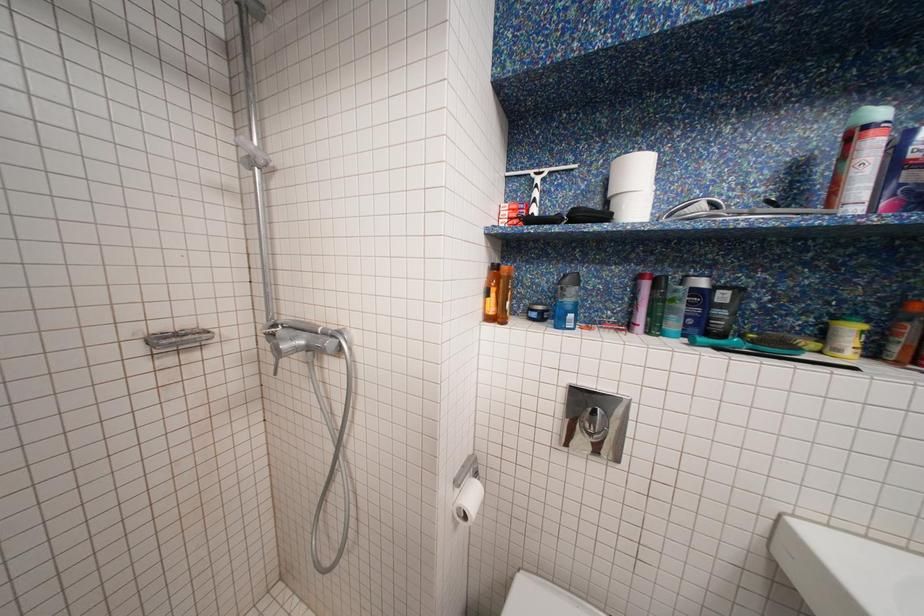
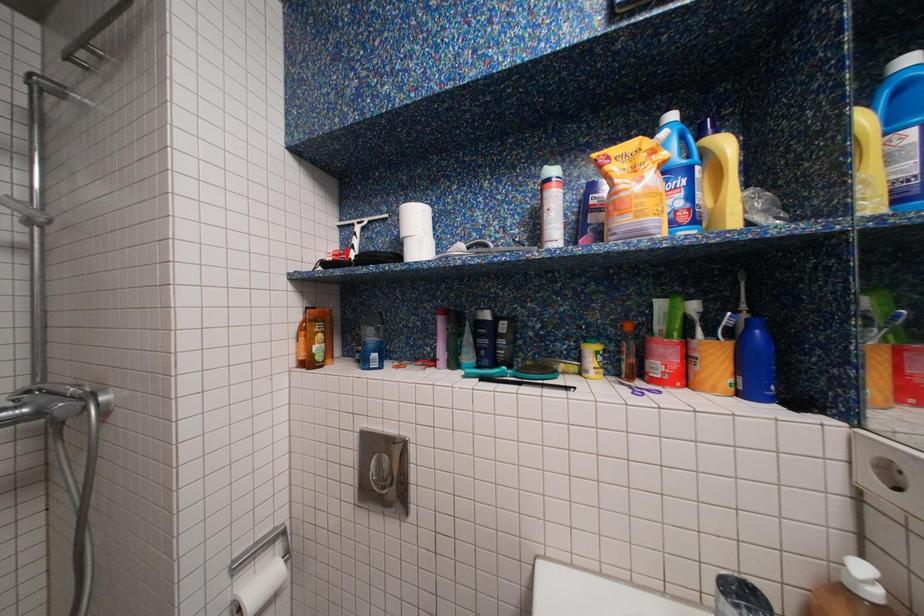
Question: Based on the continuous images, in which direction is the camera rotating? Reply with the corresponding letter.

Choices:
 (A) Left
 (B) Right
 (C) Up
 (D) Down

Answer: (C)